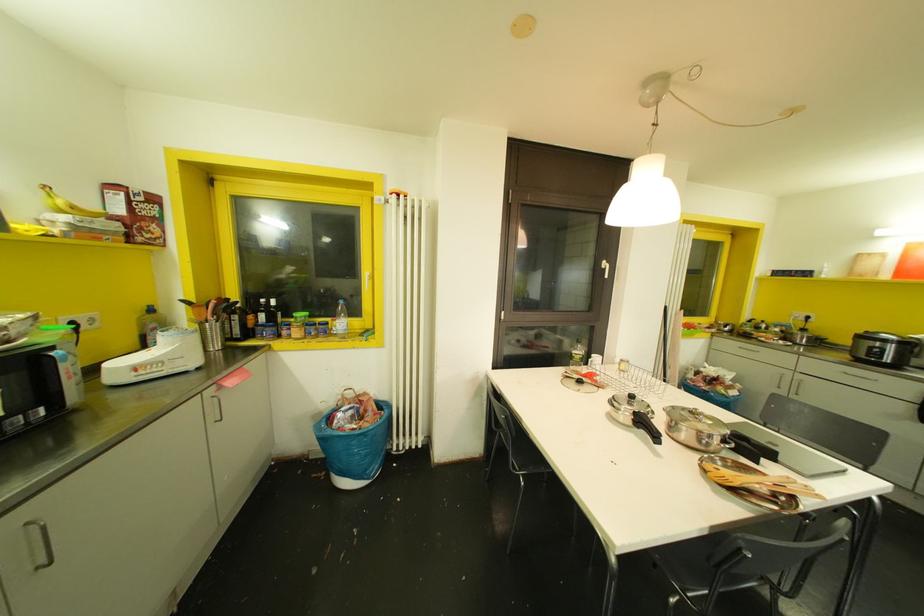
Find the location of a particular element. The height and width of the screenshot is (616, 924). metal drawer handle is located at coordinates (40, 543).